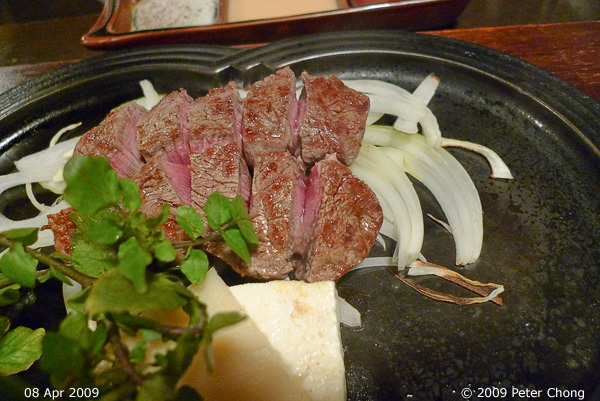
This screenshot has width=600, height=401. In order to click on plate rims in this screenshot , I will do `click(461, 54)`, `click(66, 77)`.